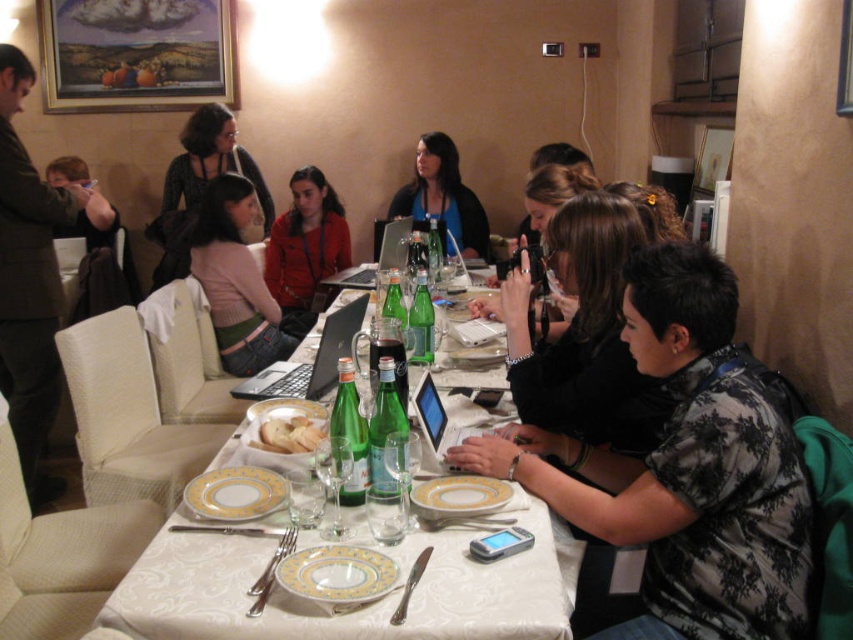
Question: Which point is farther from the camera taking this photo?

Choices:
 (A) (238, 280)
 (B) (175, 214)
 (C) (264, 442)

Answer: (B)

Question: Does matte red shirt at center appear on the left side of white bread at center?

Choices:
 (A) no
 (B) yes

Answer: (B)

Question: Is matte pink sweater at center wider than white bread at center?

Choices:
 (A) no
 (B) yes

Answer: (B)

Question: Based on their relative distances, which object is nearer to the white glossy table at center?

Choices:
 (A) white plastic laptop at center
 (B) matte black sweater at upper center

Answer: (A)

Question: Is matte black laptop at left bigger than matte red shirt at center?

Choices:
 (A) no
 (B) yes

Answer: (B)

Question: Based on their relative distances, which object is nearer to the matte pink sweater at center?

Choices:
 (A) black floral shirt at center
 (B) gold glossy plate at center

Answer: (B)